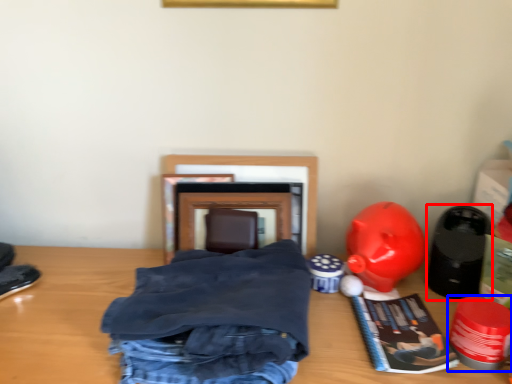
Question: Which of the following is the farthest to the observer, toy (highlighted by a red box) or toy (highlighted by a blue box)?

Choices:
 (A) toy
 (B) toy

Answer: (A)